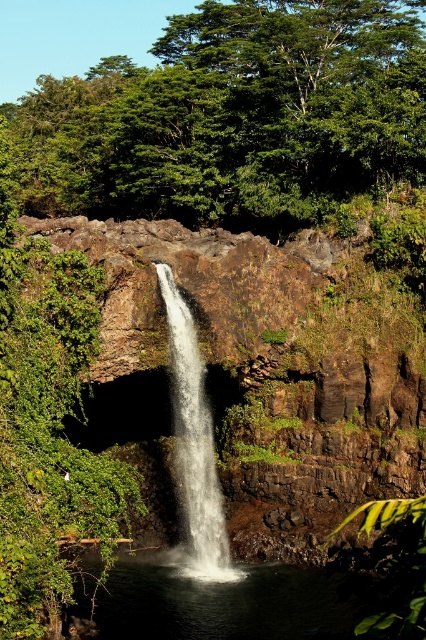
Consider the image. Is green leafy tree at upper center thinner than clear water at center?

No, green leafy tree at upper center is not thinner than clear water at center.

Between green leafy tree at upper center and clear water at center, which one appears on the right side from the viewer's perspective?

clear water at center is more to the right.

Does point (417, 44) lie behind point (212, 604)?

Yes.

Where is `green leafy tree at upper center`? The width and height of the screenshot is (426, 640). green leafy tree at upper center is located at coordinates (236, 115).

Is green leafy tree at upper center taller than translucent white water at center?

Indeed, green leafy tree at upper center has a greater height compared to translucent white water at center.

Does green leafy tree at upper center come behind translucent white water at center?

Yes.

What do you see at coordinates (236, 115) in the screenshot? I see `green leafy tree at upper center` at bounding box center [236, 115].

Find the location of `green leafy tree at upper center`. green leafy tree at upper center is located at coordinates pyautogui.click(x=236, y=115).

Measure the distance from clear water at center to translucent white water at center.

clear water at center is 6.38 meters from translucent white water at center.

Is clear water at center shorter than translucent white water at center?

Indeed, clear water at center has a lesser height compared to translucent white water at center.

In order to click on clear water at center in this screenshot , I will do 221,602.

Identify the location of clear water at center. (221, 602).